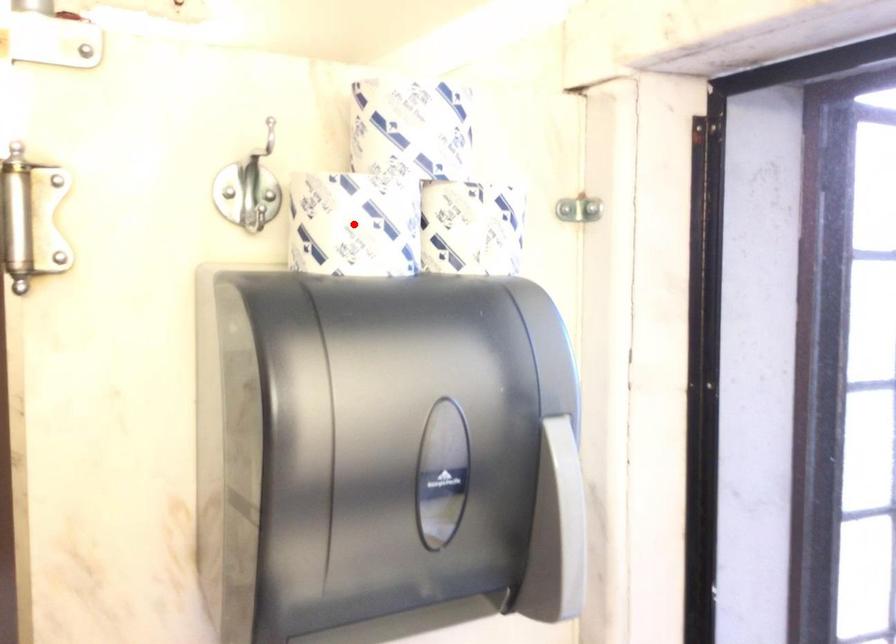
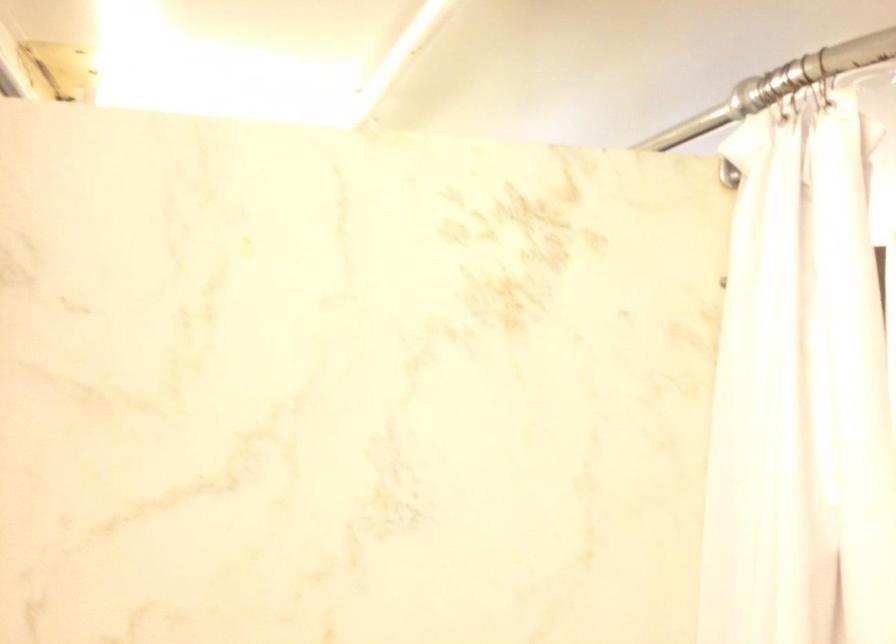
Question: I am providing you with two images of the same scene from different viewpoints. A red point is marked on the first image. At the location where the point appears in image 1, is it still visible in image 2?

Choices:
 (A) Yes
 (B) No

Answer: (B)